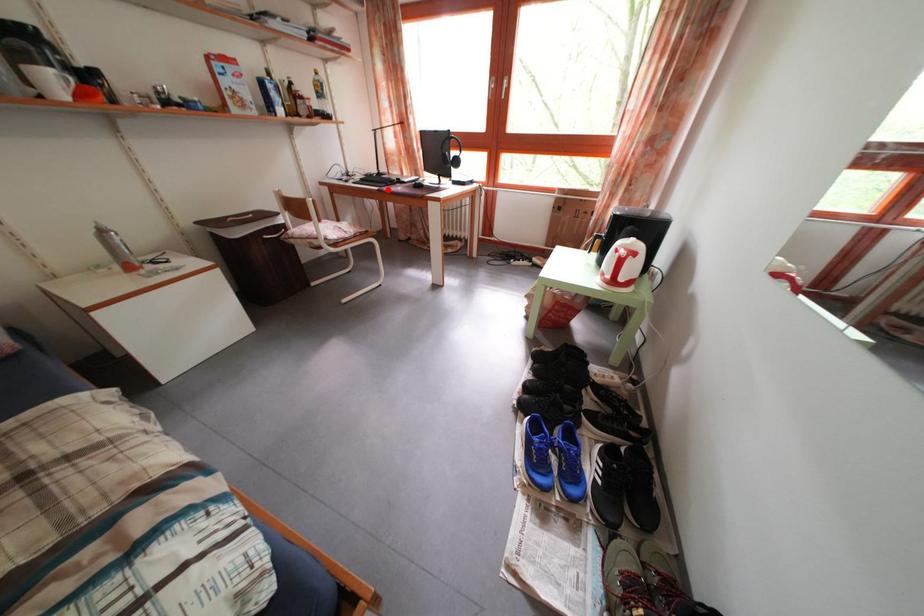
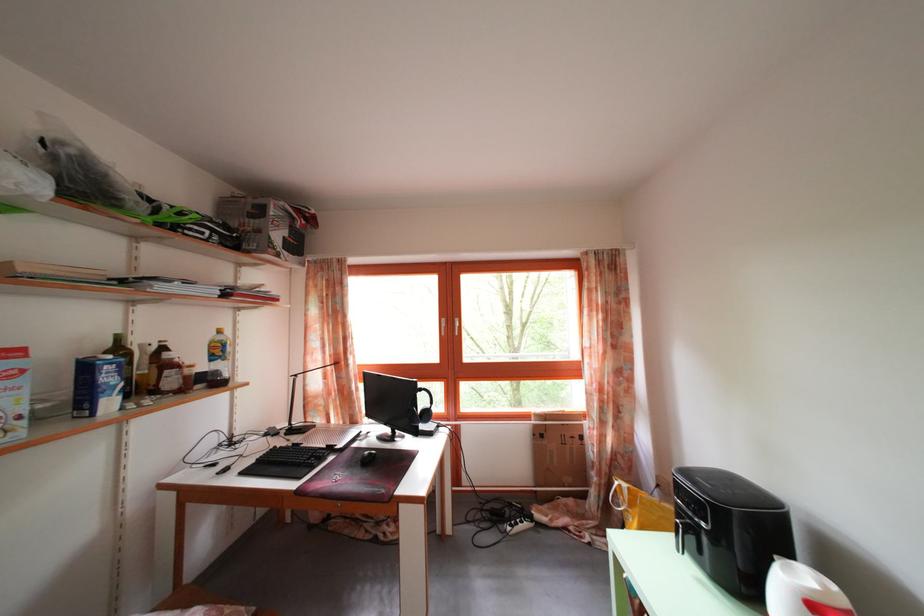
Question: A red point is marked in image1. In image2, is the corresponding 3D point closer to the camera or farther? Reply with the corresponding letter.

Choices:
 (A) The corresponding 3D point is closer.
 (B) The corresponding 3D point is farther.

Answer: (B)